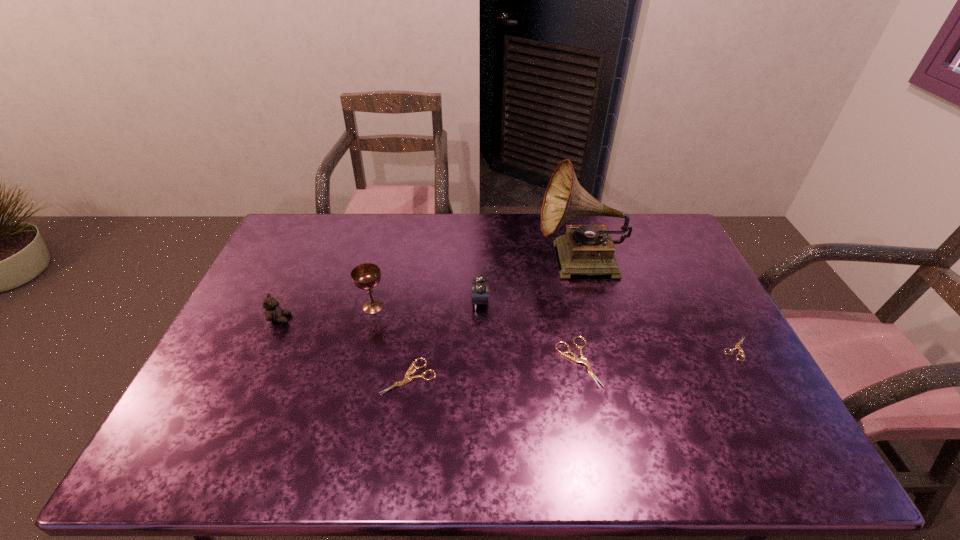
Given the evenly spaced shearss in the image, where should an extra shears be added on the left to preserve the spacing? Please point to a vacant space. Please provide its 2D coordinates. Your answer should be formatted as a tuple, i.e. [(x, y)], where the tuple contains the x and y coordinates of a point satisfying the conditions above.

[(229, 392)]